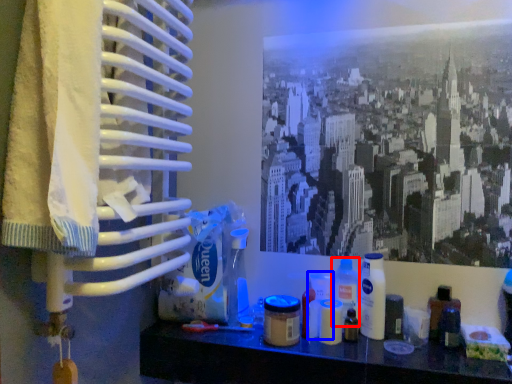
Question: Which point is closer to the camera, cleaning product (highlighted by a red box) or toiletry (highlighted by a blue box)?

Choices:
 (A) cleaning product
 (B) toiletry

Answer: (A)